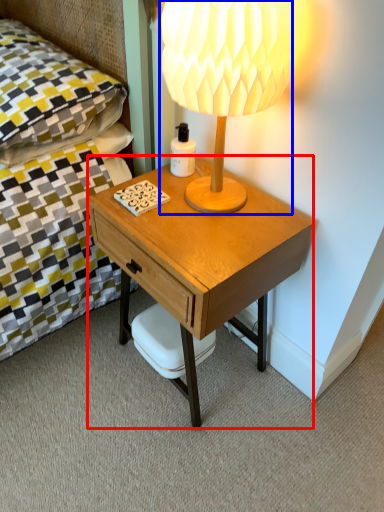
Question: Which of the following is the farthest to the observer, desk (highlighted by a red box) or lamp (highlighted by a blue box)?

Choices:
 (A) desk
 (B) lamp

Answer: (A)